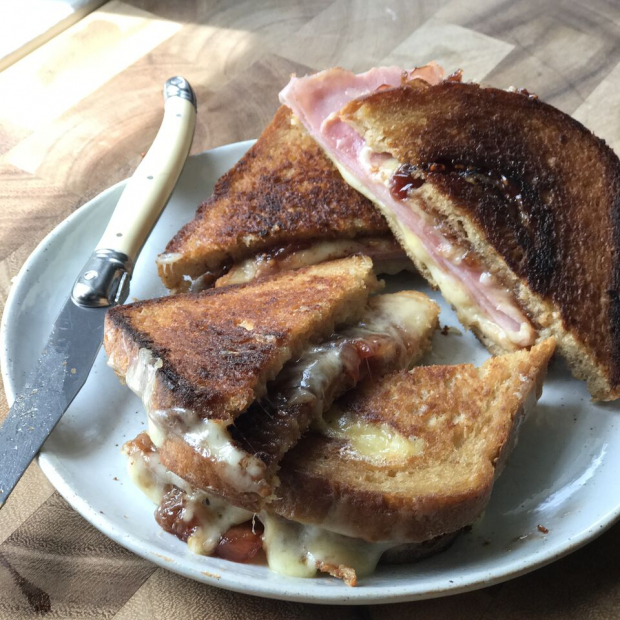
Where is `light`? This screenshot has height=620, width=620. light is located at coordinates (38, 24).